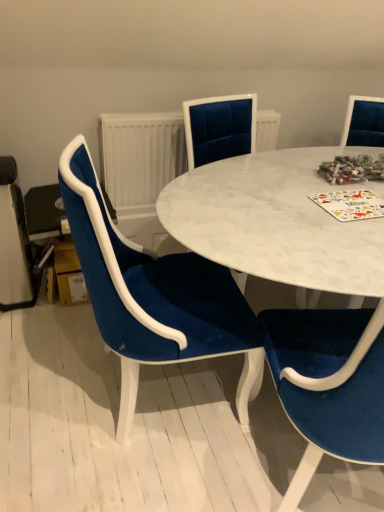
Locate an element on the screen. The width and height of the screenshot is (384, 512). free space in front of velvet blue chair at left, which is the first chair in left-to-right order is located at coordinates (137, 479).